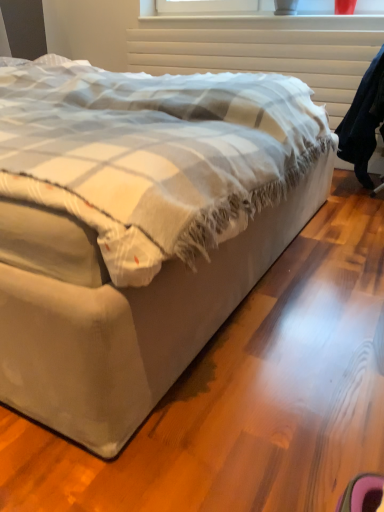
Question: Considering the positions of dark blue fabric robe at right and white textured radiator at upper center in the image, is dark blue fabric robe at right bigger or smaller than white textured radiator at upper center?

Choices:
 (A) small
 (B) big

Answer: (B)

Question: In terms of height, does dark blue fabric robe at right look taller or shorter compared to white textured radiator at upper center?

Choices:
 (A) short
 (B) tall

Answer: (B)

Question: Which of these objects is positioned farthest from the beige fabric bed at center?

Choices:
 (A) dark blue fabric robe at right
 (B) white textured radiator at upper center

Answer: (B)

Question: Based on their relative distances, which object is farther from the beige fabric bed at center?

Choices:
 (A) white textured radiator at upper center
 (B) dark blue fabric robe at right

Answer: (A)